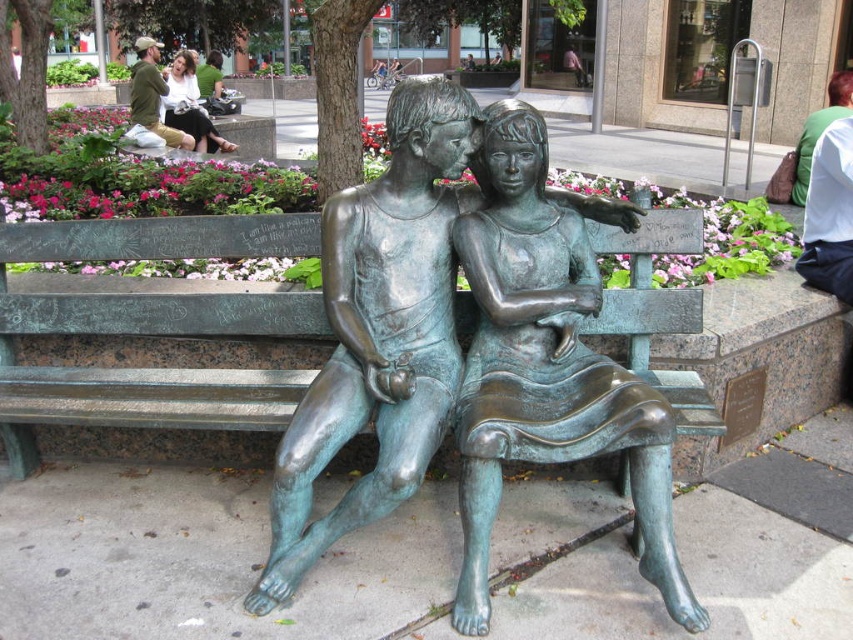
Does bronze statue at center come behind matte green statue at upper left?

No, it is in front of matte green statue at upper left.

Does bronze statue at center have a lesser height compared to matte green statue at upper left?

No, bronze statue at center is not shorter than matte green statue at upper left.

At what (x,y) coordinates should I click in order to perform the action: click on bronze statue at center. Please return your answer as a coordinate pair (x, y). Looking at the image, I should click on (379, 332).

Between green patina bench at center and bronze statue at center, which one has less height?

green patina bench at center is shorter.

At what (x,y) coordinates should I click in order to perform the action: click on green patina bench at center. Please return your answer as a coordinate pair (x, y). Looking at the image, I should click on (152, 330).

Does bronze statue at center appear on the left side of green patina bronze statue at center?

Correct, you'll find bronze statue at center to the left of green patina bronze statue at center.

Is bronze statue at center taller than green patina bronze statue at center?

Indeed, bronze statue at center has a greater height compared to green patina bronze statue at center.

Is point (399, 330) positioned after point (509, 106)?

No, (399, 330) is in front of (509, 106).

Locate an element on the screen. bronze statue at center is located at coordinates click(x=379, y=332).